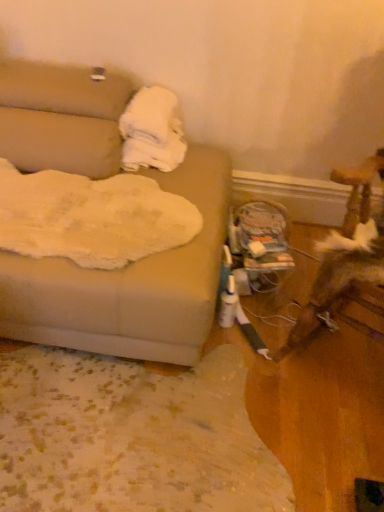
What is the approximate width of white soft blanket at upper right?

It is 16.54 inches.

Where is `white soft blanket at upper right`? The image size is (384, 512). white soft blanket at upper right is located at coordinates (152, 131).

What do you see at coordinates (152, 131) in the screenshot?
I see `white soft blanket at upper right` at bounding box center [152, 131].

At what (x,y) coordinates should I click in order to perform the action: click on white soft blanket at upper right. Please return your answer as a coordinate pair (x, y). Looking at the image, I should click on (152, 131).